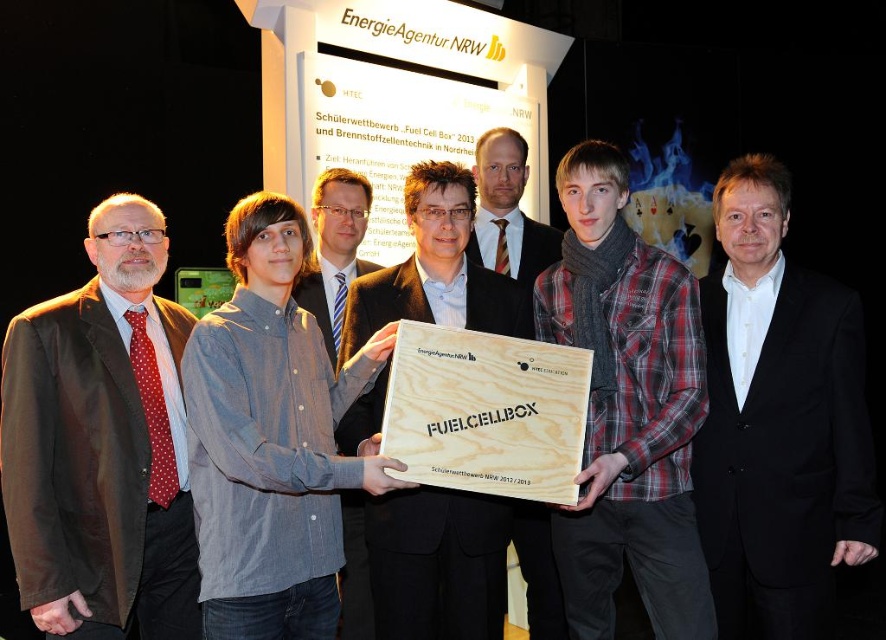
Which of these two, black suit at center or denim shirt at center, stands taller?

black suit at center

Can you confirm if black suit at center is shorter than denim shirt at center?

No, black suit at center is not shorter than denim shirt at center.

What do you see at coordinates (778, 422) in the screenshot? This screenshot has width=886, height=640. I see `black suit at center` at bounding box center [778, 422].

Find the location of a particular element. This screenshot has height=640, width=886. black suit at center is located at coordinates (778, 422).

The height and width of the screenshot is (640, 886). Describe the element at coordinates (778, 422) in the screenshot. I see `black suit at center` at that location.

Can you confirm if black suit at center is smaller than matte black jacket at center?

Incorrect, black suit at center is not smaller in size than matte black jacket at center.

Describe the element at coordinates (778, 422) in the screenshot. The width and height of the screenshot is (886, 640). I see `black suit at center` at that location.

The height and width of the screenshot is (640, 886). In order to click on black suit at center in this screenshot , I will do click(778, 422).

Can you confirm if black suit at center is smaller than wooden at center?

Incorrect, black suit at center is not smaller in size than wooden at center.

Identify the location of black suit at center. (778, 422).

Does point (868, 444) come behind point (563, 467)?

Yes.

Where is `black suit at center`? This screenshot has width=886, height=640. black suit at center is located at coordinates (778, 422).